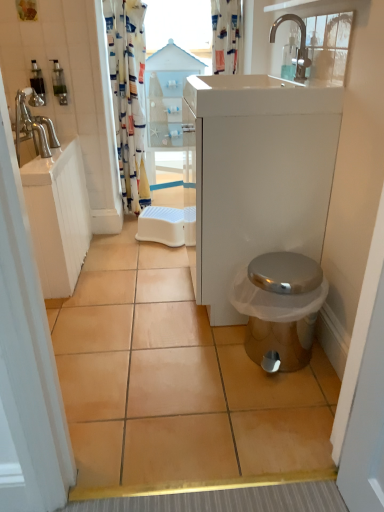
Question: Are white glossy sink at upper center and printed fabric shower curtain at upper center, which appears as the 2th shower curtain when viewed from the left, beside each other?

Choices:
 (A) no
 (B) yes

Answer: (A)

Question: Would you say white glossy sink at upper center is a long distance from printed fabric shower curtain at upper center, which is the 1th shower curtain in right-to-left order?

Choices:
 (A) no
 (B) yes

Answer: (B)

Question: Is white glossy sink at upper center smaller than printed fabric shower curtain at upper center, which is the 1th shower curtain in right-to-left order?

Choices:
 (A) no
 (B) yes

Answer: (A)

Question: Does white glossy sink at upper center appear on the right side of printed fabric shower curtain at upper center, which appears as the 2th shower curtain when viewed from the left?

Choices:
 (A) yes
 (B) no

Answer: (A)

Question: Is white glossy sink at upper center at the left side of printed fabric shower curtain at upper center, which is the 1th shower curtain in right-to-left order?

Choices:
 (A) yes
 (B) no

Answer: (B)

Question: Based on their sizes in the image, would you say transparent wood cabinet at center is bigger or smaller than beige ceramic tile at center?

Choices:
 (A) small
 (B) big

Answer: (B)

Question: From a real-world perspective, is transparent wood cabinet at center physically located above or below beige ceramic tile at center?

Choices:
 (A) below
 (B) above

Answer: (B)

Question: Relative to beige ceramic tile at center, is transparent wood cabinet at center in front or behind?

Choices:
 (A) front
 (B) behind

Answer: (B)

Question: Is point (188, 56) closer or farther from the camera than point (304, 466)?

Choices:
 (A) farther
 (B) closer

Answer: (A)

Question: From the image's perspective, is white glossy sink at upper center positioned above or below transparent glass window at upper center?

Choices:
 (A) above
 (B) below

Answer: (B)

Question: From their relative heights in the image, would you say white glossy sink at upper center is taller or shorter than transparent glass window at upper center?

Choices:
 (A) tall
 (B) short

Answer: (B)

Question: From a real-world perspective, is white glossy sink at upper center above or below transparent glass window at upper center?

Choices:
 (A) above
 (B) below

Answer: (B)

Question: Based on their positions, is white glossy sink at upper center located to the left or right of transparent glass window at upper center?

Choices:
 (A) right
 (B) left

Answer: (B)

Question: Choose the correct answer: Is transparent plastic window screen at upper center inside translucent plastic soap dispenser at upper left, positioned as the second toiletry in right-to-left order, or outside it?

Choices:
 (A) outside
 (B) inside

Answer: (A)

Question: In the image, is transparent plastic window screen at upper center on the left side or the right side of translucent plastic soap dispenser at upper left, acting as the first toiletry starting from the left?

Choices:
 (A) right
 (B) left

Answer: (A)